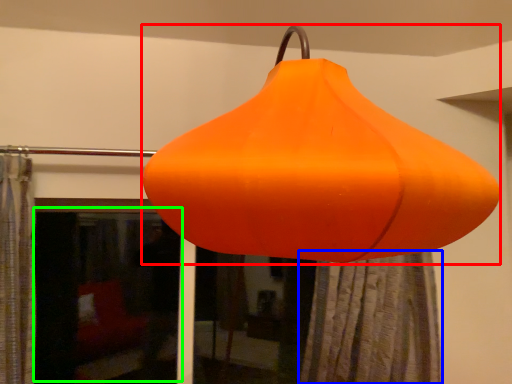
Question: Which object is the closest to the lantern (highlighted by a red box)? Choose among these: shower curtain (highlighted by a blue box) or window screen (highlighted by a green box).

Choices:
 (A) shower curtain
 (B) window screen

Answer: (A)